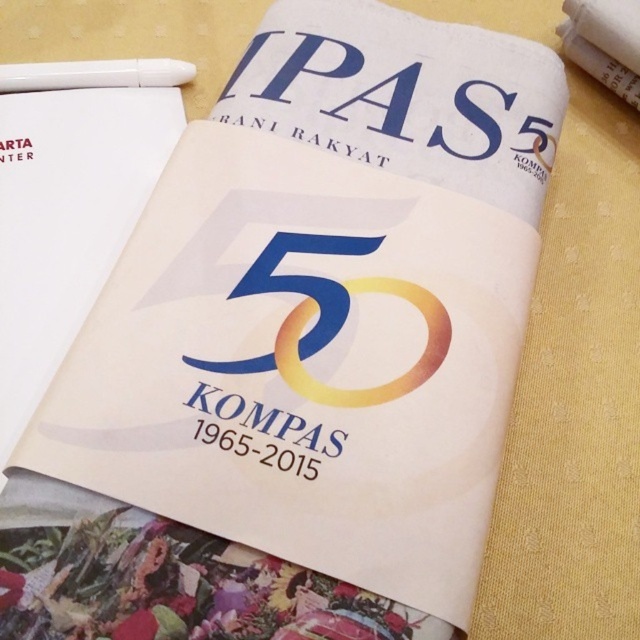
Question: Does blue glossy number at center come behind white plastic pen at upper left?

Choices:
 (A) no
 (B) yes

Answer: (A)

Question: Which of the following is the closest to the observer?

Choices:
 (A) blue glossy number at center
 (B) white plastic pen at upper left

Answer: (A)

Question: Which point is closer to the camera?

Choices:
 (A) (81, 88)
 (B) (356, 280)

Answer: (B)

Question: Does blue glossy number at center appear under white plastic pen at upper left?

Choices:
 (A) no
 (B) yes

Answer: (B)

Question: Can you confirm if blue glossy number at center is smaller than white plastic pen at upper left?

Choices:
 (A) yes
 (B) no

Answer: (B)